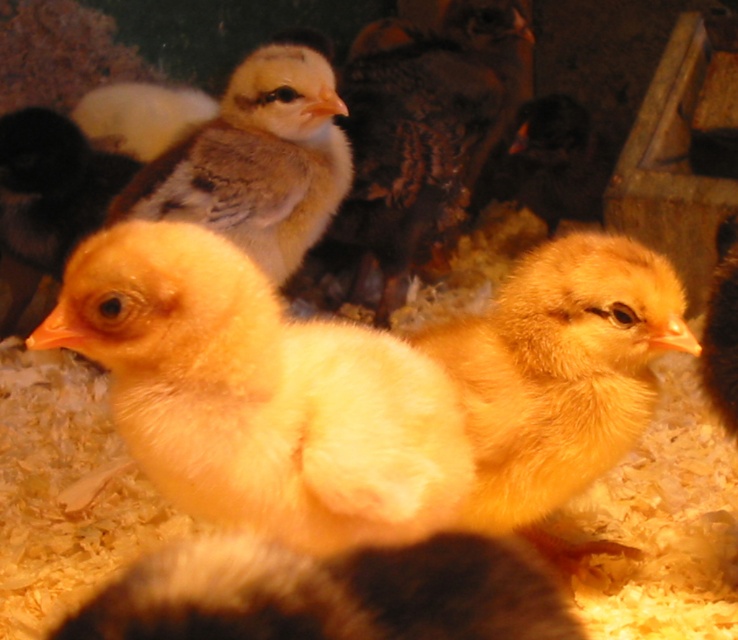
Question: Is yellow downy chick at center to the left of fluffy yellow chick at center from the viewer's perspective?

Choices:
 (A) no
 (B) yes

Answer: (B)

Question: Which point is closer to the camera?

Choices:
 (A) fluffy yellow chick at center
 (B) soft yellow chick at center

Answer: (A)

Question: Does fluffy yellow chick at center have a greater width compared to soft yellow chick at center?

Choices:
 (A) yes
 (B) no

Answer: (B)

Question: Estimate the real-world distances between objects in this image. Which object is closer to the yellow downy chick at center?

Choices:
 (A) soft yellow chick at center
 (B) fluffy yellow chick at center

Answer: (B)

Question: Is yellow downy chick at center wider than fluffy yellow chick at center?

Choices:
 (A) yes
 (B) no

Answer: (A)

Question: Which is nearer to the yellow downy chick at center?

Choices:
 (A) soft yellow chick at center
 (B) fluffy yellow chick at center

Answer: (B)